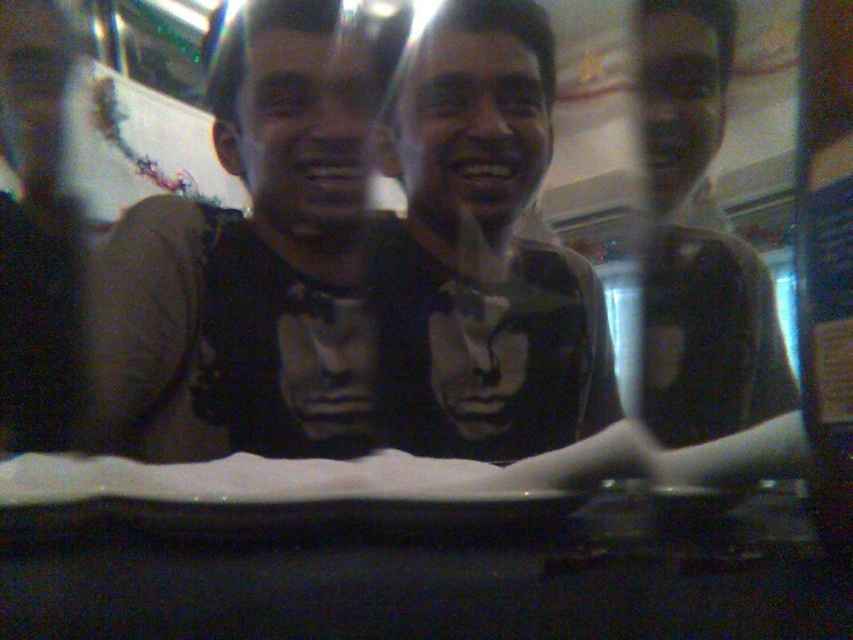
Is black plastic table at lower center above matte black t-shirt at center?

No, black plastic table at lower center is not above matte black t-shirt at center.

Locate an element on the screen. Image resolution: width=853 pixels, height=640 pixels. black plastic table at lower center is located at coordinates (445, 582).

Can you confirm if matte black bow tie at center is positioned to the left of matte black t-shirt at center?

Indeed, matte black bow tie at center is positioned on the left side of matte black t-shirt at center.

Is matte black bow tie at center thinner than matte black t-shirt at center?

Incorrect, matte black bow tie at center's width is not less than matte black t-shirt at center's.

What do you see at coordinates (254, 253) in the screenshot? The image size is (853, 640). I see `matte black bow tie at center` at bounding box center [254, 253].

Identify the location of matte black bow tie at center. (254, 253).

Is black plastic table at lower center shorter than matte black shirt at center?

Yes, black plastic table at lower center is shorter than matte black shirt at center.

Who is higher up, black plastic table at lower center or matte black shirt at center?

Positioned higher is matte black shirt at center.

Between point (596, 544) and point (692, 362), which one is positioned behind?

Positioned behind is point (692, 362).

What are the coordinates of `black plastic table at lower center` in the screenshot? It's located at (445, 582).